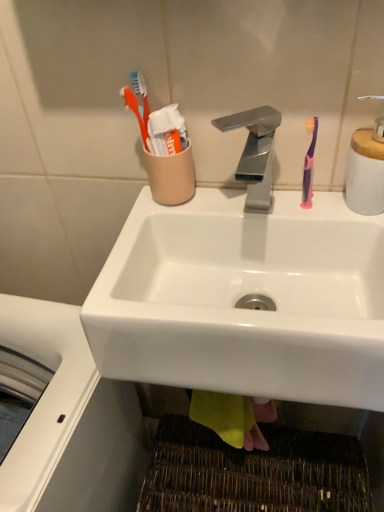
Question: Does white ceramic soap dispenser at upper right come behind polished metallic faucet at center?

Choices:
 (A) no
 (B) yes

Answer: (B)

Question: Could you tell me if white ceramic soap dispenser at upper right is facing polished metallic faucet at center?

Choices:
 (A) no
 (B) yes

Answer: (A)

Question: From a real-world perspective, is white ceramic soap dispenser at upper right over polished metallic faucet at center?

Choices:
 (A) no
 (B) yes

Answer: (B)

Question: Considering the relative sizes of white ceramic soap dispenser at upper right and polished metallic faucet at center in the image provided, is white ceramic soap dispenser at upper right smaller than polished metallic faucet at center?

Choices:
 (A) yes
 (B) no

Answer: (A)

Question: Would you say white ceramic soap dispenser at upper right contains polished metallic faucet at center?

Choices:
 (A) yes
 (B) no

Answer: (B)

Question: Is polished metallic faucet at center taller or shorter than white glossy sink at center?

Choices:
 (A) tall
 (B) short

Answer: (B)

Question: Is polished metallic faucet at center in front of or behind white glossy sink at center in the image?

Choices:
 (A) behind
 (B) front

Answer: (A)

Question: Would you say polished metallic faucet at center is inside or outside white glossy sink at center?

Choices:
 (A) inside
 (B) outside

Answer: (B)

Question: Based on their positions, is polished metallic faucet at center located to the left or right of white glossy sink at center?

Choices:
 (A) left
 (B) right

Answer: (A)

Question: Is point (256, 174) closer or farther from the camera than point (372, 197)?

Choices:
 (A) closer
 (B) farther

Answer: (B)

Question: Is polished metallic faucet at center wider or thinner than white ceramic soap dispenser at upper right?

Choices:
 (A) thin
 (B) wide

Answer: (B)

Question: Is polished metallic faucet at center situated inside white ceramic soap dispenser at upper right or outside?

Choices:
 (A) inside
 (B) outside

Answer: (B)

Question: In the image, is polished metallic faucet at center on the left side or the right side of white ceramic soap dispenser at upper right?

Choices:
 (A) right
 (B) left

Answer: (B)

Question: Does point (306, 181) appear closer or farther from the camera than point (357, 165)?

Choices:
 (A) farther
 (B) closer

Answer: (A)

Question: Considering their positions, is pink plastic toothbrush at right located in front of or behind white ceramic soap dispenser at upper right?

Choices:
 (A) front
 (B) behind

Answer: (B)